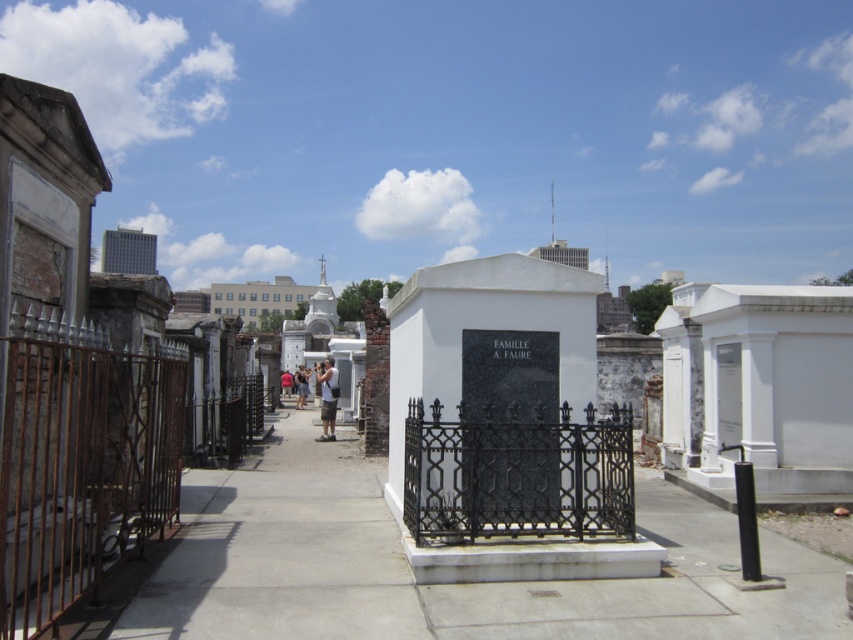
Who is positioned more to the left, black wrought iron fence at center or red shirt at center?

From the viewer's perspective, red shirt at center appears more on the left side.

Can you confirm if black wrought iron fence at center is positioned to the left of red shirt at center?

Incorrect, black wrought iron fence at center is not on the left side of red shirt at center.

Who is more distant from viewer, (485, 417) or (288, 378)?

Answer: The point (288, 378) is behind.

This screenshot has height=640, width=853. What are the coordinates of `black wrought iron fence at center` in the screenshot? It's located at (517, 474).

Does rusty iron fence at left have a greater width compared to camouflage shorts at center?

No.

Is point (210, 413) closer to viewer compared to point (329, 440)?

That is True.

What are the coordinates of `rusty iron fence at left` in the screenshot? It's located at (91, 458).

Between point (331, 580) and point (303, 372), which one is positioned in front?

Point (331, 580) is more forward.

Is white concrete pavement at center to the right of light brown leather jacket at center from the viewer's perspective?

Correct, you'll find white concrete pavement at center to the right of light brown leather jacket at center.

The height and width of the screenshot is (640, 853). Describe the element at coordinates (444, 584) in the screenshot. I see `white concrete pavement at center` at that location.

At what (x,y) coordinates should I click in order to perform the action: click on white concrete pavement at center. Please return your answer as a coordinate pair (x, y). Looking at the image, I should click on (444, 584).